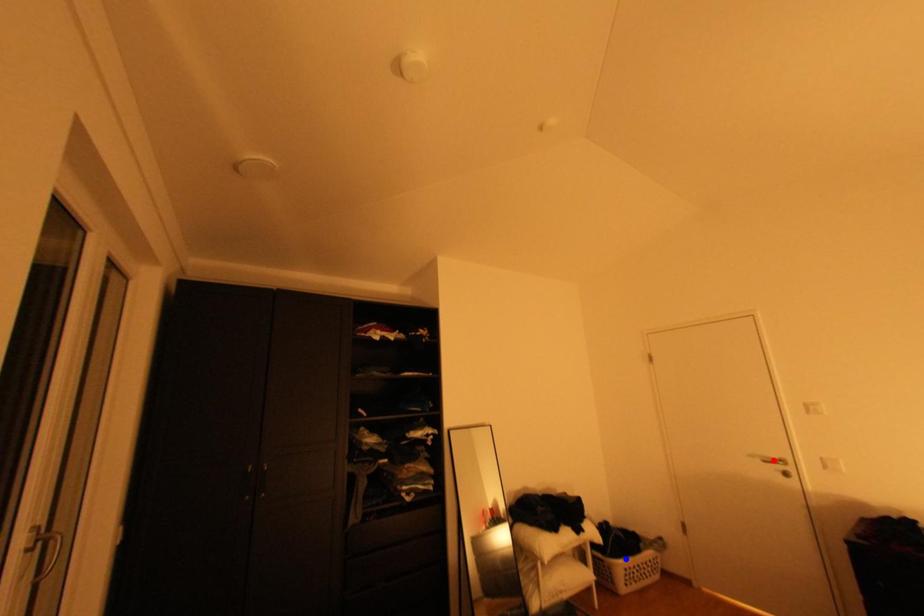
Question: In the image, two points are highlighted. Which point is nearer to the camera? Reply with the corresponding letter.

Choices:
 (A) blue point
 (B) red point

Answer: (B)